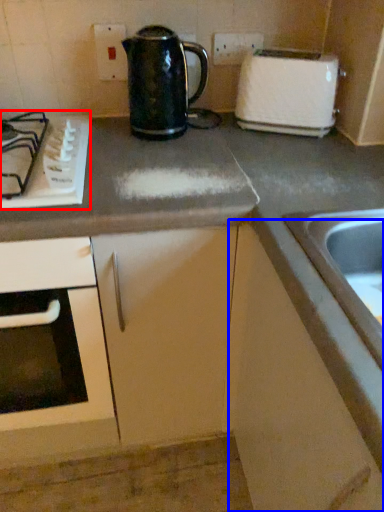
Question: Which point is closer to the camera, gas stove (highlighted by a red box) or cabinetry (highlighted by a blue box)?

Choices:
 (A) gas stove
 (B) cabinetry

Answer: (B)